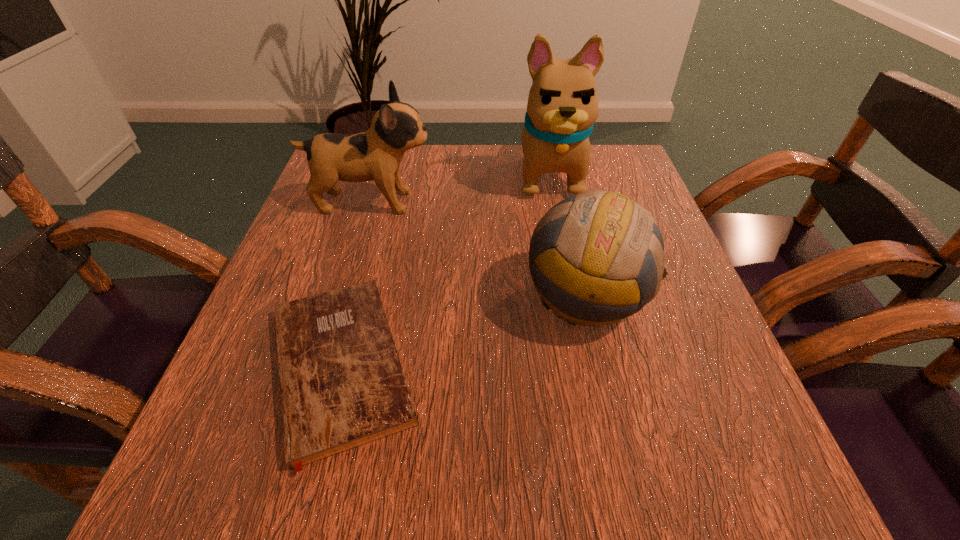
You are a GUI agent. You are given a task and a screenshot of the screen. Output one action in this format:
    pyautogui.click(x=<x>, y=<y>)
    Task: Click on the taller puppy
    
    Given the screenshot: What is the action you would take?
    pyautogui.click(x=562, y=107)

Where is `the right puppy`? This screenshot has height=540, width=960. the right puppy is located at coordinates (562, 107).

Identify the location of the second tallest object. The width and height of the screenshot is (960, 540). (376, 154).

In order to click on the left puppy in this screenshot , I will do `click(376, 154)`.

The height and width of the screenshot is (540, 960). I want to click on volleyball, so click(x=605, y=234).

At what (x,y) coordinates should I click in order to perform the action: click on Bible. Please return your answer as a coordinate pair (x, y). The image size is (960, 540). Looking at the image, I should click on (342, 385).

This screenshot has height=540, width=960. Identify the location of free space located 0.180m on the face of the right puppy. (567, 264).

I want to click on free point located at the face of the left puppy, so click(x=588, y=202).

The width and height of the screenshot is (960, 540). Identify the location of free space located 0.230m on the back of the third tallest object. (562, 189).

Where is `free spot located on the right of the shortest object`? free spot located on the right of the shortest object is located at coordinates (588, 366).